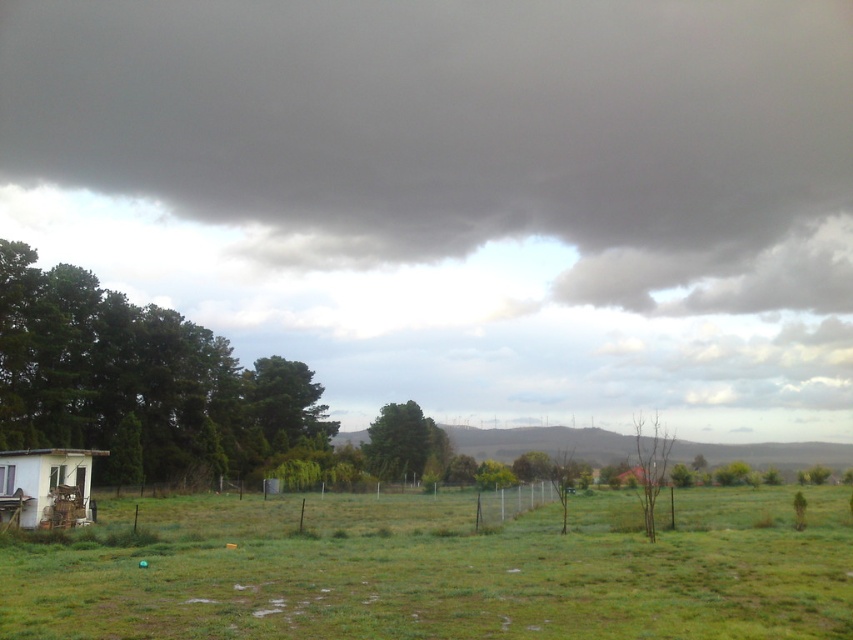
Who is taller, green grassy field at center or green leafy tree at left?

green leafy tree at left

Between green grassy field at center and green leafy tree at left, which one appears on the left side from the viewer's perspective?

Positioned to the left is green leafy tree at left.

Is point (102, 544) behind point (190, 392)?

No, (102, 544) is closer to viewer.

Where is `green grassy field at center`? This screenshot has height=640, width=853. green grassy field at center is located at coordinates [439, 570].

Is point (431, 452) less distant than point (647, 483)?

No, it is not.

Where is `green matte tree at center`? The width and height of the screenshot is (853, 640). green matte tree at center is located at coordinates (404, 444).

In the scene shown: Can you confirm if green leafy tree at left is bigger than green leafy tree at center?

Yes, green leafy tree at left is bigger than green leafy tree at center.

Between point (125, 397) and point (321, 440), which one is positioned in front?

Point (125, 397) is more forward.

The width and height of the screenshot is (853, 640). I want to click on green leafy tree at left, so click(138, 380).